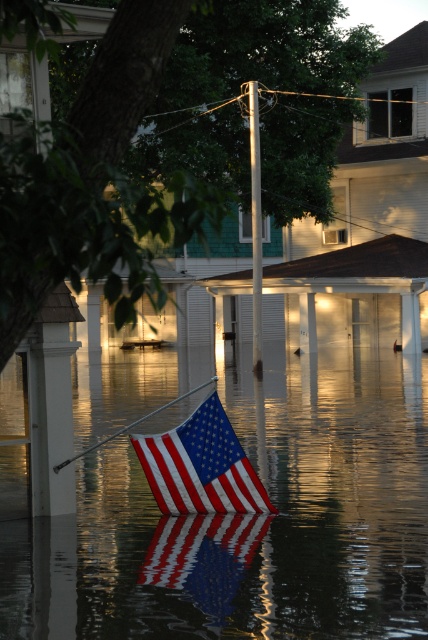
Question: Estimate the real-world distances between objects in this image. Which object is farther from the american flag at center?

Choices:
 (A) metallic pole at center
 (B) reflective water at center

Answer: (A)

Question: Does reflective water at center appear on the right side of metallic pole at center?

Choices:
 (A) yes
 (B) no

Answer: (B)

Question: Which of the following is the farthest from the observer?

Choices:
 (A) (216, 433)
 (B) (253, 248)
 (C) (287, 593)

Answer: (B)

Question: Is american flag at center smaller than metallic pole at center?

Choices:
 (A) no
 (B) yes

Answer: (B)

Question: Can you confirm if reflective water at center is positioned to the right of metallic pole at center?

Choices:
 (A) no
 (B) yes

Answer: (A)

Question: Which point is farther to the camera?

Choices:
 (A) reflective water at center
 (B) metallic pole at center
 (C) american flag at center

Answer: (B)